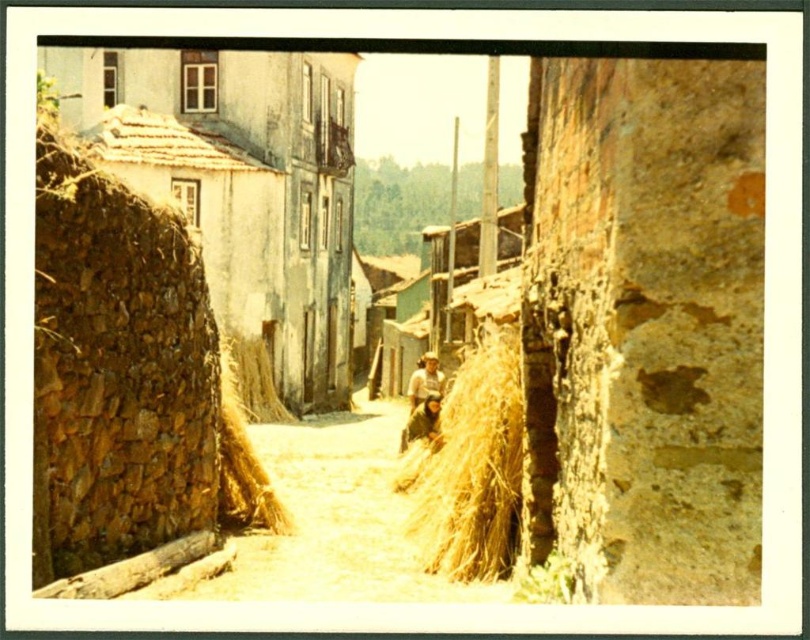
Question: Based on their relative distances, which object is nearer to the stone textured hut at left?

Choices:
 (A) golden straw at center
 (B) golden straw bale at left

Answer: (A)

Question: Is stone textured hut at left above golden straw at center?

Choices:
 (A) no
 (B) yes

Answer: (B)

Question: Is yellow straw at center wider than brown straw at center?

Choices:
 (A) no
 (B) yes

Answer: (A)

Question: Based on their relative distances, which object is farther from the yellow straw at center?

Choices:
 (A) stone textured hut at left
 (B) golden straw at center
 (C) golden straw bale at left
 (D) brown straw at center

Answer: (D)

Question: In this image, where is stone textured hut at left located relative to golden straw at center?

Choices:
 (A) below
 (B) above

Answer: (B)

Question: Which of the following is the farthest from the observer?

Choices:
 (A) (263, 525)
 (B) (357, 497)
 (C) (458, 420)

Answer: (B)